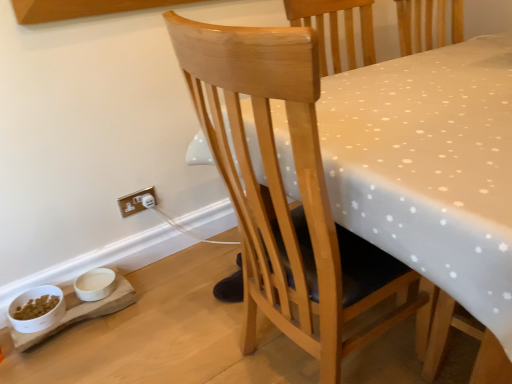
In order to click on vacant space situated above white glossy bowl at lower left, the 2th bowl from the right (from a real-world perspective) in this screenshot , I will do `click(37, 302)`.